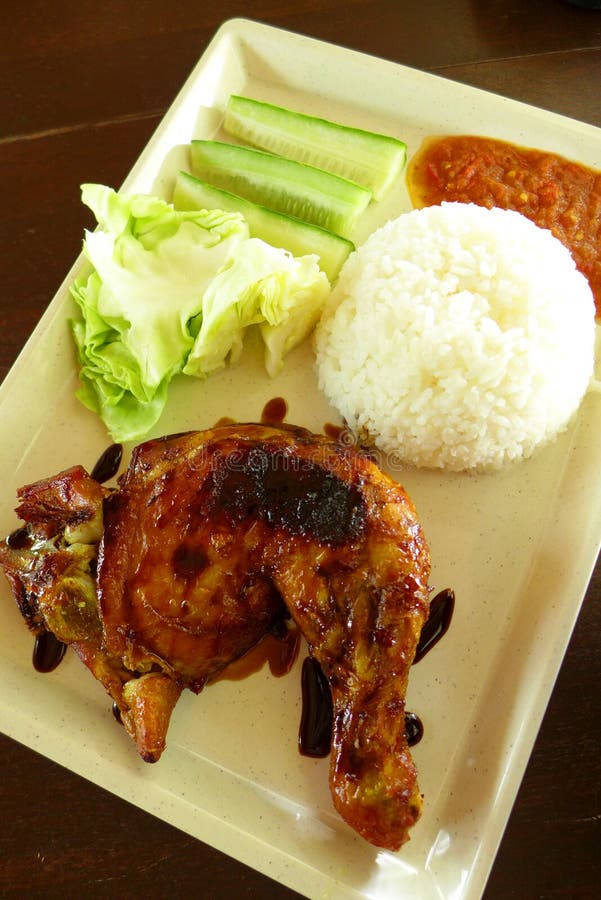
Find the location of a particular element. Image resolution: width=601 pixels, height=900 pixels. rectangular plate is located at coordinates (495, 579).